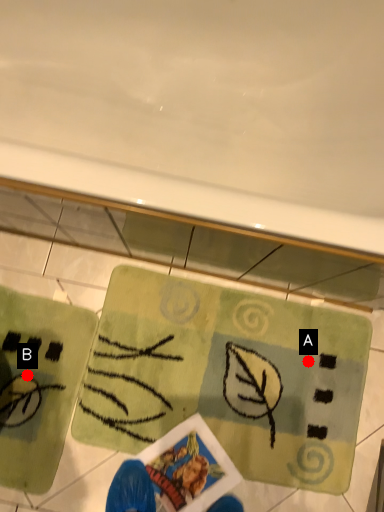
Question: Two points are circled on the image, labeled by A and B beside each circle. Among these points, which one is nearest to the camera?

Choices:
 (A) A is closer
 (B) B is closer

Answer: (B)